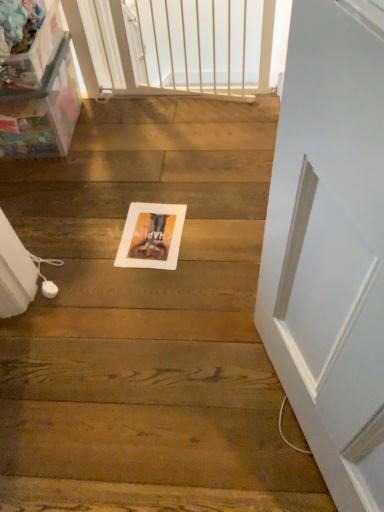
I want to click on free spot above white paper postcard at center (from a real-world perspective), so click(x=142, y=233).